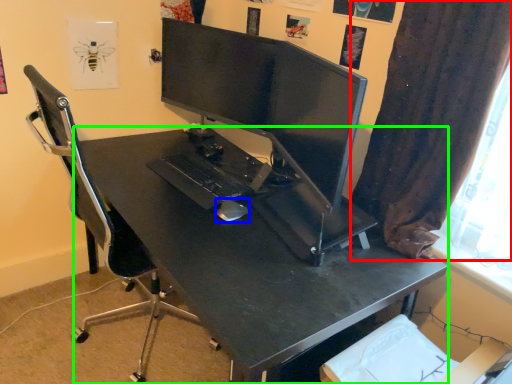
Question: Estimate the real-world distances between objects in this image. Which object is closer to curtain (highlighted by a red box), mouse (highlighted by a blue box) or desk (highlighted by a green box)?

Choices:
 (A) mouse
 (B) desk

Answer: (B)